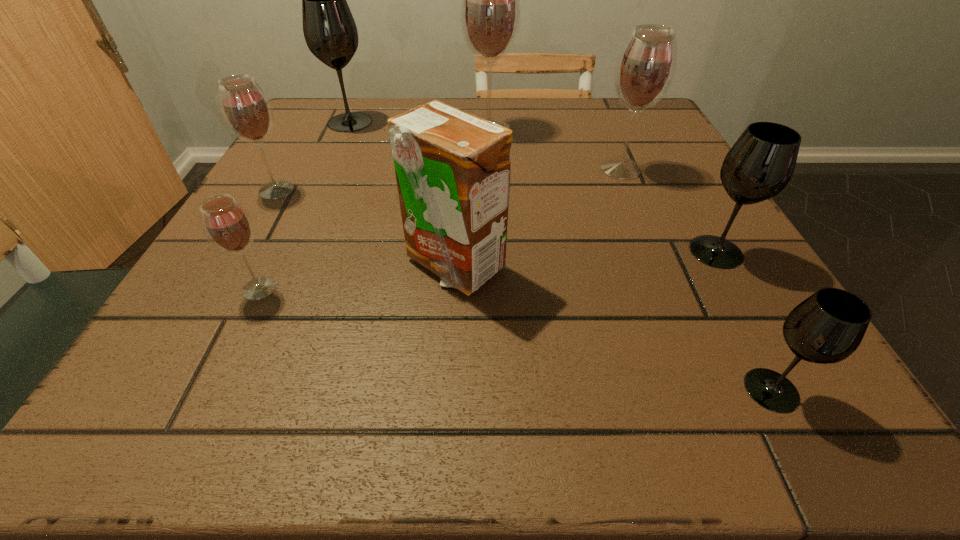
Choose which wineglass is the second nearest neighbor to the biggest red wineglass. Please provide its 2D coordinates. Your answer should be formatted as a tuple, i.e. [(x, y)], where the tuple contains the x and y coordinates of a point satisfying the conditions above.

[(330, 32)]

Identify the location of red wineglass object that ranks as the closest to the second nearest gray wineglass. (645, 68).

This screenshot has width=960, height=540. Identify the location of red wineglass identified as the closest to the second farthest gray wineglass. 645,68.

Identify which gray wineglass is the third closest to the rightmost red wineglass. Please provide its 2D coordinates. Your answer should be formatted as a tuple, i.e. [(x, y)], where the tuple contains the x and y coordinates of a point satisfying the conditions above.

[(330, 32)]

Identify which gray wineglass is the third nearest to the second biggest red wineglass. Please provide its 2D coordinates. Your answer should be formatted as a tuple, i.e. [(x, y)], where the tuple contains the x and y coordinates of a point satisfying the conditions above.

[(330, 32)]

Identify the location of vacant area that satisfies the following two spatial constraints: 1. on the straw side of the carton; 2. on the left side of the smallest gray wineglass. This screenshot has height=540, width=960. (446, 390).

Locate an element on the screen. Image resolution: width=960 pixels, height=540 pixels. free space in the image that satisfies the following two spatial constraints: 1. on the straw side of the carton; 2. on the right side of the nearest gray wineglass is located at coordinates (446, 390).